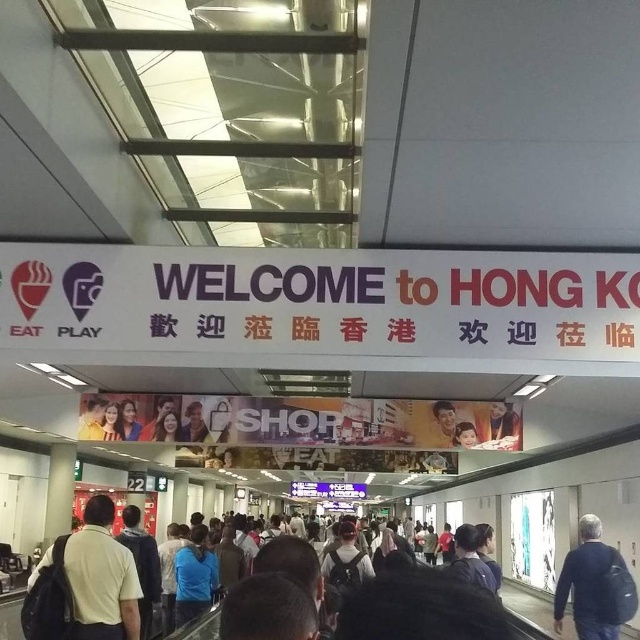
Question: Which point is closer to the camera taking this photo?

Choices:
 (A) (198, 433)
 (B) (93, 596)

Answer: (B)

Question: Is dark blue jacket at lower right further to the viewer compared to light brown leather jacket at center?

Choices:
 (A) yes
 (B) no

Answer: (B)

Question: Which object is the farthest from the smooth skin face at center?

Choices:
 (A) dark blue jacket at lower right
 (B) light brown leather jacket at center
 (C) light brown backpack at center

Answer: (C)

Question: Is light brown leather jacket at center thinner than smooth skin face at center?

Choices:
 (A) yes
 (B) no

Answer: (B)

Question: Where is dark blue jacket at lower right located in relation to smooth skin face at center in the image?

Choices:
 (A) left
 (B) right

Answer: (B)

Question: Which object is closer to the camera taking this photo?

Choices:
 (A) dark blue jacket at lower right
 (B) light brown backpack at center
 (C) smooth skin face at center
 (D) light brown leather jacket at center

Answer: (B)